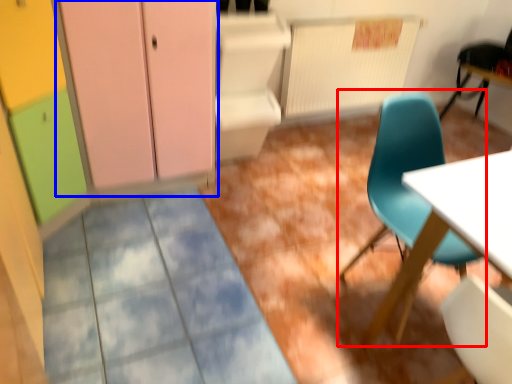
Question: Which point is closer to the camera, chair (highlighted by a red box) or dresser (highlighted by a blue box)?

Choices:
 (A) chair
 (B) dresser

Answer: (A)